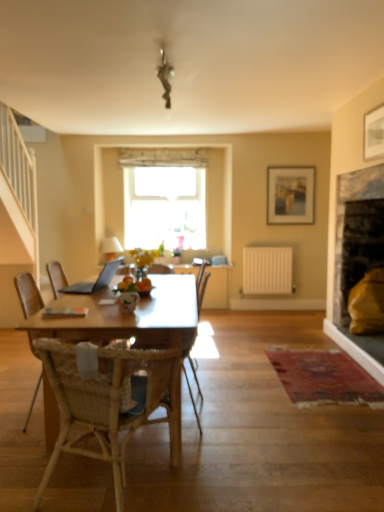
Question: Is white matte radiator at center-right surrounded by silver metallic laptop at center?

Choices:
 (A) yes
 (B) no

Answer: (B)

Question: Considering the relative sizes of silver metallic laptop at center and white matte radiator at center-right in the image provided, is silver metallic laptop at center taller than white matte radiator at center-right?

Choices:
 (A) no
 (B) yes

Answer: (A)

Question: Can you confirm if silver metallic laptop at center is positioned to the right of white matte radiator at center-right?

Choices:
 (A) no
 (B) yes

Answer: (A)

Question: Does silver metallic laptop at center come in front of white matte radiator at center-right?

Choices:
 (A) yes
 (B) no

Answer: (A)

Question: From a real-world perspective, is silver metallic laptop at center positioned over white matte radiator at center-right based on gravity?

Choices:
 (A) yes
 (B) no

Answer: (A)

Question: In terms of width, does woven wood chair at center, acting as the second chair starting from the front, look wider or thinner when compared to woven wood chair at center, the 1th chair when ordered from back to front?

Choices:
 (A) wide
 (B) thin

Answer: (A)

Question: Is woven wood chair at center, which is counted as the second chair, starting from the back, situated inside woven wood chair at center, the 1th chair when ordered from back to front, or outside?

Choices:
 (A) outside
 (B) inside

Answer: (A)

Question: Would you say woven wood chair at center, which is counted as the second chair, starting from the back, is to the left or to the right of woven wood chair at center, the 3th chair when ordered from front to back, in the picture?

Choices:
 (A) left
 (B) right

Answer: (A)

Question: From the image's perspective, is woven wood chair at center, acting as the second chair starting from the front, located above or below woven wood chair at center, the 1th chair when ordered from back to front?

Choices:
 (A) above
 (B) below

Answer: (B)

Question: Looking at their shapes, would you say silver metallic laptop at center is wider or thinner than matte wooden picture frame at upper center, which appears as the first picture frame when viewed from the back?

Choices:
 (A) wide
 (B) thin

Answer: (A)

Question: Is point (110, 270) positioned closer to the camera than point (273, 184)?

Choices:
 (A) closer
 (B) farther

Answer: (A)

Question: From the image's perspective, is silver metallic laptop at center positioned above or below matte wooden picture frame at upper center, which appears as the first picture frame when viewed from the back?

Choices:
 (A) above
 (B) below

Answer: (B)

Question: Visually, is silver metallic laptop at center positioned to the left or to the right of matte wooden picture frame at upper center, the second picture frame positioned from the right?

Choices:
 (A) right
 (B) left

Answer: (B)

Question: From a real-world perspective, relative to woven wood chair at center, which ranks as the third chair in back-to-front order, is woven wood chair at center, which is counted as the second chair, starting from the back, vertically above or below?

Choices:
 (A) below
 (B) above

Answer: (A)

Question: Considering the positions of woven wood chair at center, acting as the second chair starting from the front, and woven wood chair at center, which is the 1th chair from front to back, in the image, is woven wood chair at center, acting as the second chair starting from the front, bigger or smaller than woven wood chair at center, which is the 1th chair from front to back,?

Choices:
 (A) big
 (B) small

Answer: (A)